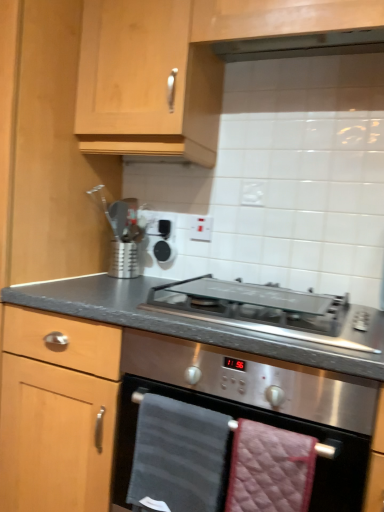
Question: Is dark gray textured towel at center, positioned as the 1th hand towel in left-to-right order, facing towards quilted pink hand towel at lower center, the 2th hand towel from the left?

Choices:
 (A) no
 (B) yes

Answer: (A)

Question: Can you confirm if dark gray textured towel at center, positioned as the 1th hand towel in left-to-right order, is positioned to the left of quilted pink hand towel at lower center, the 2th hand towel from the left?

Choices:
 (A) no
 (B) yes

Answer: (B)

Question: Is the depth of dark gray textured towel at center, acting as the second hand towel starting from the right, greater than that of quilted pink hand towel at lower center, the 2th hand towel from the left?

Choices:
 (A) no
 (B) yes

Answer: (B)

Question: Can you confirm if dark gray textured towel at center, positioned as the 1th hand towel in left-to-right order, is wider than quilted pink hand towel at lower center, the 2th hand towel from the left?

Choices:
 (A) no
 (B) yes

Answer: (B)

Question: Is dark gray textured towel at center, acting as the second hand towel starting from the right, thinner than quilted pink hand towel at lower center, which ranks as the first hand towel in right-to-left order?

Choices:
 (A) no
 (B) yes

Answer: (A)

Question: In terms of size, does satin silver glass at center appear bigger or smaller than stainless steel oven at center?

Choices:
 (A) small
 (B) big

Answer: (A)

Question: Is satin silver glass at center wider or thinner than stainless steel oven at center?

Choices:
 (A) wide
 (B) thin

Answer: (B)

Question: In the image, is satin silver glass at center on the left side or the right side of stainless steel oven at center?

Choices:
 (A) left
 (B) right

Answer: (B)

Question: From the image's perspective, is satin silver glass at center located above or below stainless steel oven at center?

Choices:
 (A) below
 (B) above

Answer: (B)

Question: Looking at the image, does quilted pink hand towel at lower center, which ranks as the first hand towel in right-to-left order, seem bigger or smaller compared to satin silver utensil holder at upper center?

Choices:
 (A) small
 (B) big

Answer: (B)

Question: Is quilted pink hand towel at lower center, the 2th hand towel from the left, spatially inside satin silver utensil holder at upper center, or outside of it?

Choices:
 (A) outside
 (B) inside

Answer: (A)

Question: From a real-world perspective, is quilted pink hand towel at lower center, which ranks as the first hand towel in right-to-left order, positioned above or below satin silver utensil holder at upper center?

Choices:
 (A) above
 (B) below

Answer: (B)

Question: From their relative heights in the image, would you say quilted pink hand towel at lower center, the 2th hand towel from the left, is taller or shorter than satin silver utensil holder at upper center?

Choices:
 (A) tall
 (B) short

Answer: (A)

Question: From a real-world perspective, is satin silver utensil holder at upper center above or below dark gray textured towel at center, acting as the second hand towel starting from the right?

Choices:
 (A) above
 (B) below

Answer: (A)

Question: Is satin silver utensil holder at upper center situated inside dark gray textured towel at center, acting as the second hand towel starting from the right, or outside?

Choices:
 (A) inside
 (B) outside

Answer: (B)